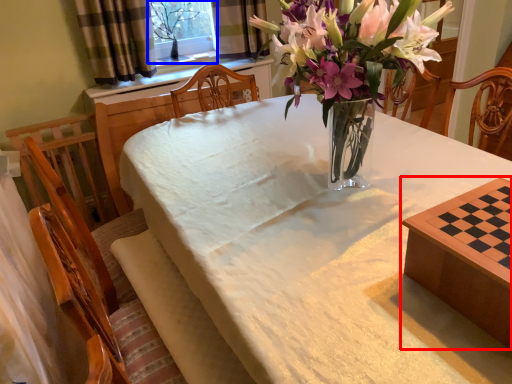
Question: Which object is further to the camera taking this photo, table (highlighted by a red box) or window screen (highlighted by a blue box)?

Choices:
 (A) table
 (B) window screen

Answer: (B)